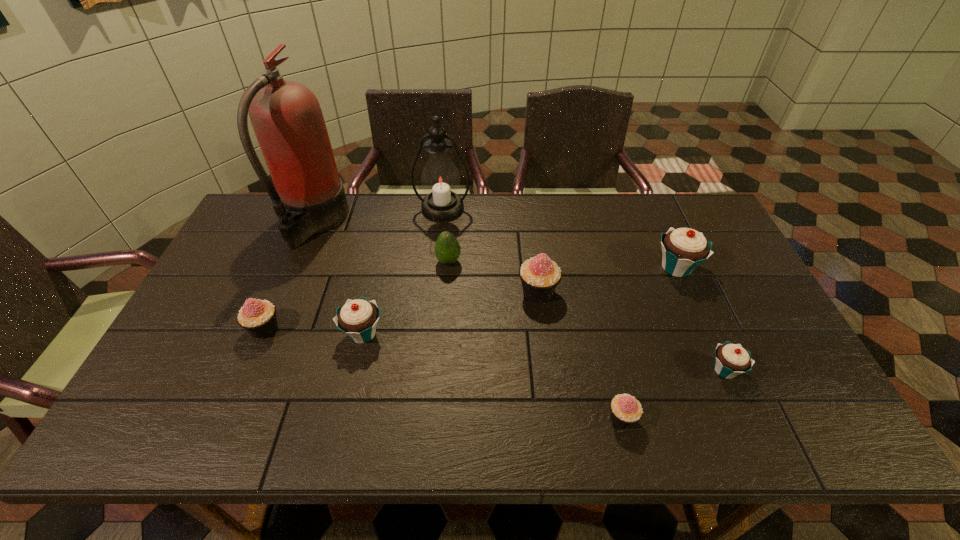
You are a GUI agent. You are given a task and a screenshot of the screen. Output one action in this format:
    pyautogui.click(x=<x>, y=<y>)
    Task: Click on the vacant space at the near edge of the desktop
    
    Given the screenshot: What is the action you would take?
    pyautogui.click(x=264, y=440)

In the image, there is a desktop. Where is `vacant space at the left edge`? This screenshot has width=960, height=540. vacant space at the left edge is located at coordinates (258, 245).

In order to click on vacant space at the right edge in this screenshot , I will do pos(737,327).

In order to click on free space at the near left corner of the desktop in this screenshot , I will do click(138, 430).

You are a GUI agent. You are given a task and a screenshot of the screen. Output one action in this format:
    pyautogui.click(x=<x>, y=<y>)
    Task: Click on the free spot at the far right corner of the desktop
    
    Given the screenshot: What is the action you would take?
    pyautogui.click(x=675, y=197)

The height and width of the screenshot is (540, 960). I want to click on free space between the second biggest teal cupcake and the oil lamp, so click(403, 271).

Where is `free space between the fourth cupcake from right to left and the second smallest pink cupcake`? This screenshot has height=540, width=960. free space between the fourth cupcake from right to left and the second smallest pink cupcake is located at coordinates (401, 310).

You are a GUI agent. You are given a task and a screenshot of the screen. Output one action in this format:
    pyautogui.click(x=<x>, y=<y>)
    Task: Click on the free point between the fourth object from right to left and the second smallest pink cupcake
    The height and width of the screenshot is (540, 960).
    Given the screenshot: What is the action you would take?
    pyautogui.click(x=401, y=310)

Image resolution: width=960 pixels, height=540 pixels. In order to click on vacant area that lies between the avocado and the leftmost cupcake in this screenshot , I will do `click(356, 295)`.

Find the location of a particular element. free space between the fire extinguisher and the leftmost teal cupcake is located at coordinates (339, 278).